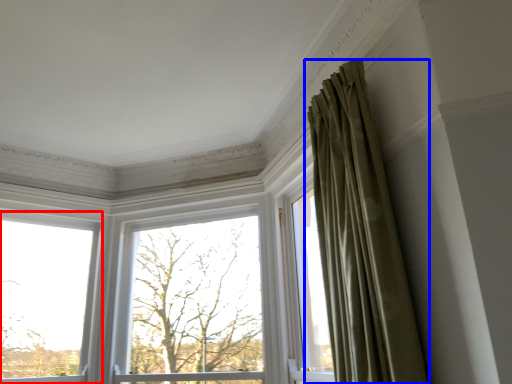
Question: Which object is closer to the camera taking this photo, window (highlighted by a red box) or curtain (highlighted by a blue box)?

Choices:
 (A) window
 (B) curtain

Answer: (B)